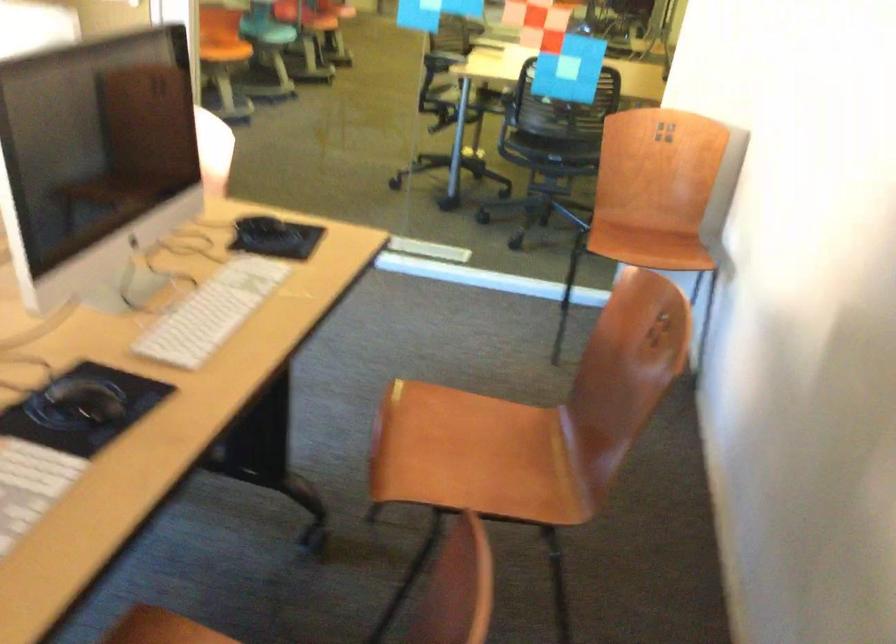
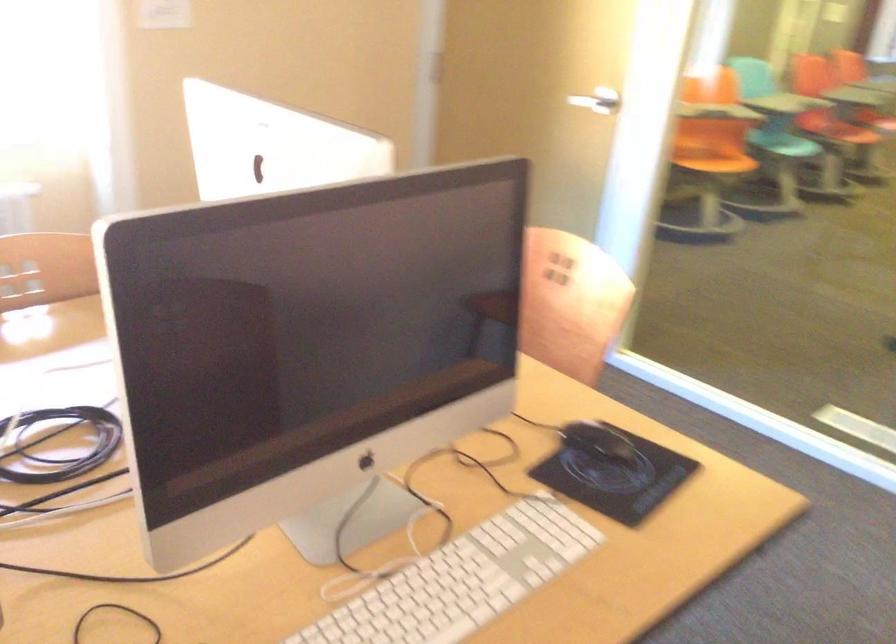
Question: How did the camera likely rotate?

Choices:
 (A) Left
 (B) Right
 (C) Up
 (D) Down

Answer: (A)